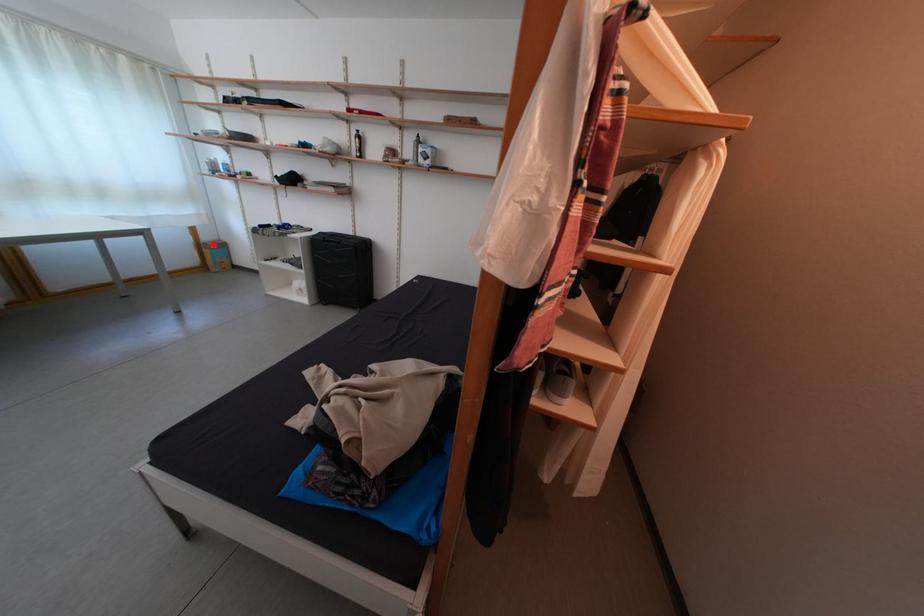
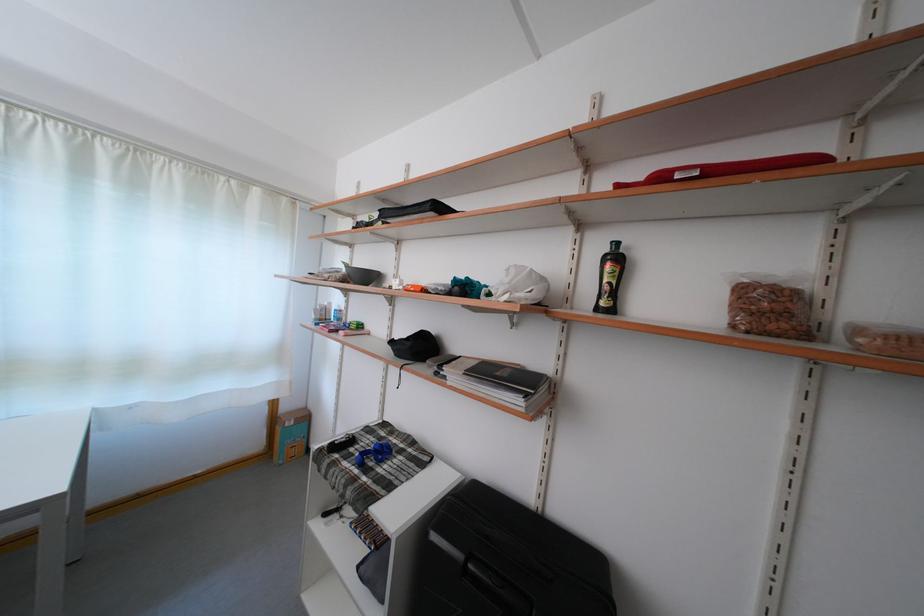
Question: A red point is marked in image1. In image2, is the corresponding 3D point closer to the camera or farther? Reply with the corresponding letter.

Choices:
 (A) The corresponding 3D point is closer.
 (B) The corresponding 3D point is farther.

Answer: (B)